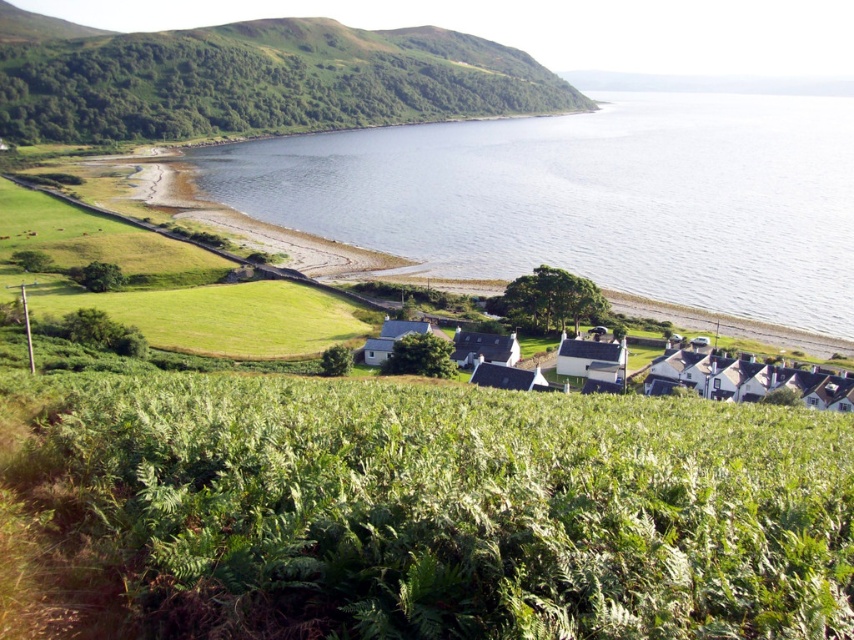
You are a photographer planning to capture the white wooden houses at center and the clear blue water at center in a single shot. Based on their positions, which one will appear closer to the camera in the final photograph?

The clear blue water at center appears closer to the camera because it is positioned over the white wooden houses at center, indicating it is layered in front of them in the image.

You are a photographer planning to capture the clear blue water at center and the green grassy hillside at upper left in a single shot. Which of these two objects will appear larger in the photo?

The clear blue water at center will appear larger in the photo because it is much taller than the green grassy hillside at upper left.

You are standing on the beach and want to take a photo of both the green grassy hillside at upper left and the white wooden houses at center. Which direction should you face to ensure both are visible in your camera frame?

You should face towards the upper left direction to include both the green grassy hillside at upper left and the white wooden houses at center in your camera frame, as the green grassy hillside at upper left is located to the left of the white wooden houses at center.